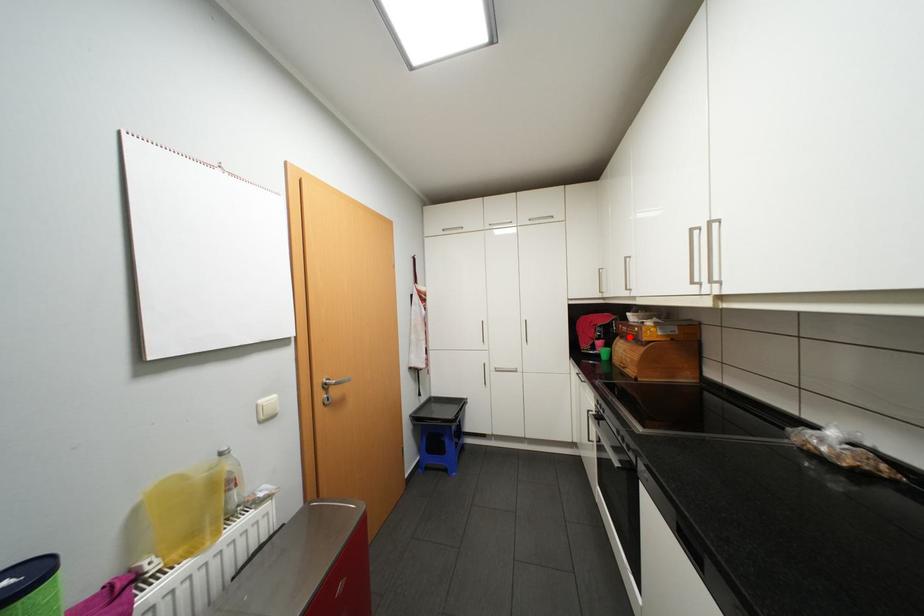
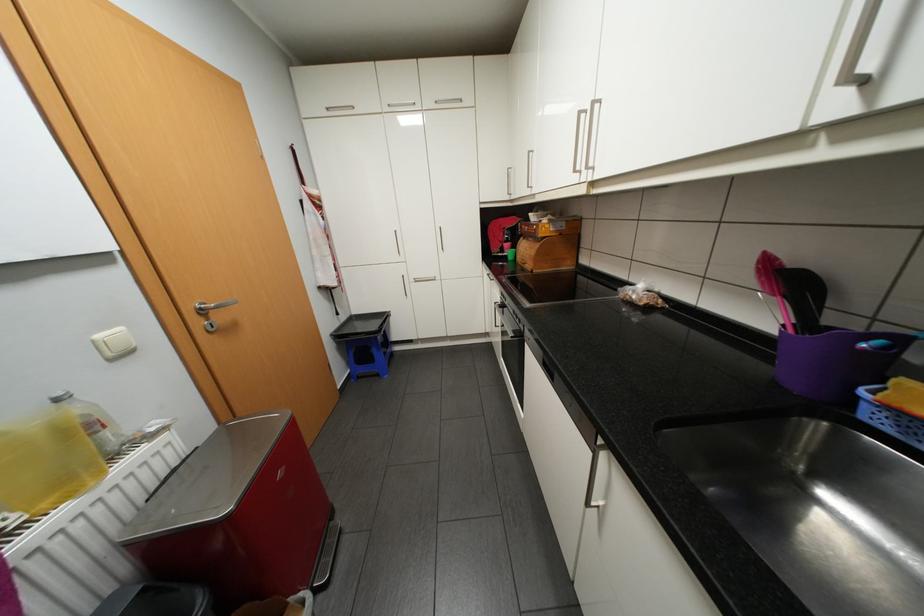
Question: I am providing you with two images of the same scene from different viewpoints. A red point is shown in image1. For the corresponding object point in image2, is it positioned nearer or farther from the camera?

Choices:
 (A) Nearer
 (B) Farther

Answer: (A)